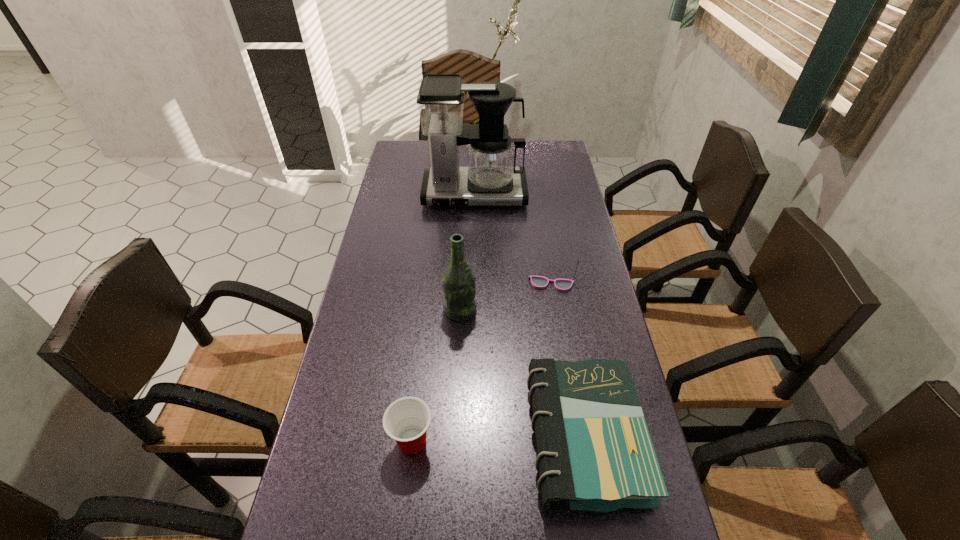
Where is `free spot that satisfies the following two spatial constraints: 1. at the front of the farthest object where the controls are located; 2. on the right side of the fourth nearest object`? The image size is (960, 540). free spot that satisfies the following two spatial constraints: 1. at the front of the farthest object where the controls are located; 2. on the right side of the fourth nearest object is located at coordinates (472, 284).

Identify the location of free location that satisfies the following two spatial constraints: 1. on the back side of the paperback book; 2. on the surface of the beer bottle. This screenshot has width=960, height=540. (562, 310).